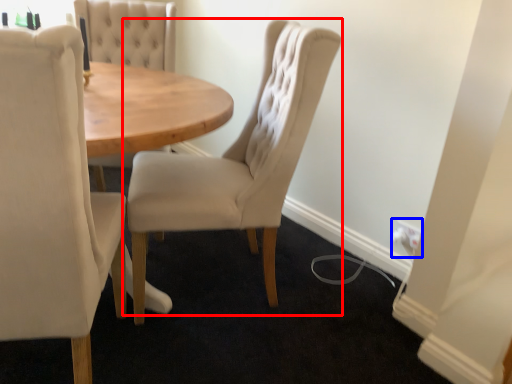
Question: Which point is closer to the camera, chair (highlighted by a red box) or electric outlet (highlighted by a blue box)?

Choices:
 (A) chair
 (B) electric outlet

Answer: (A)